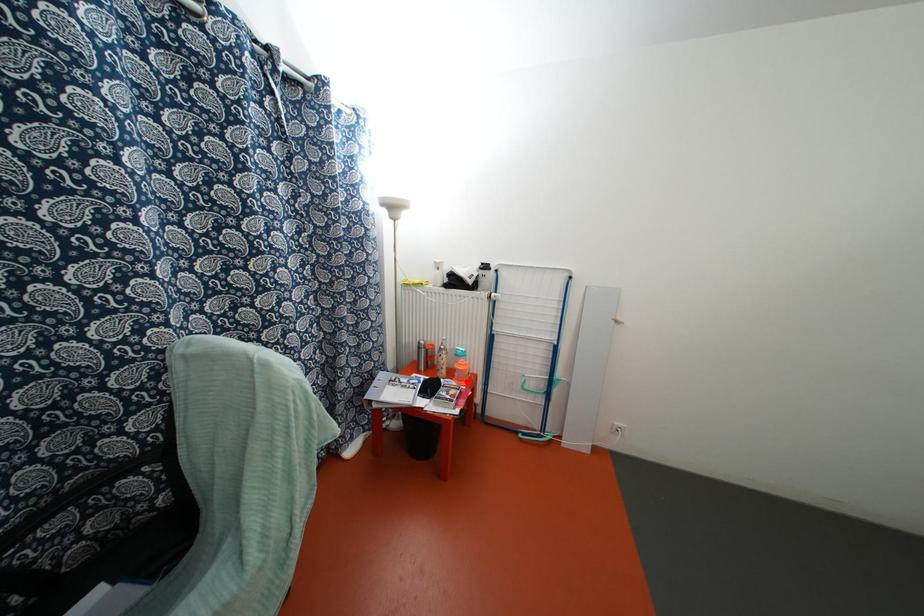
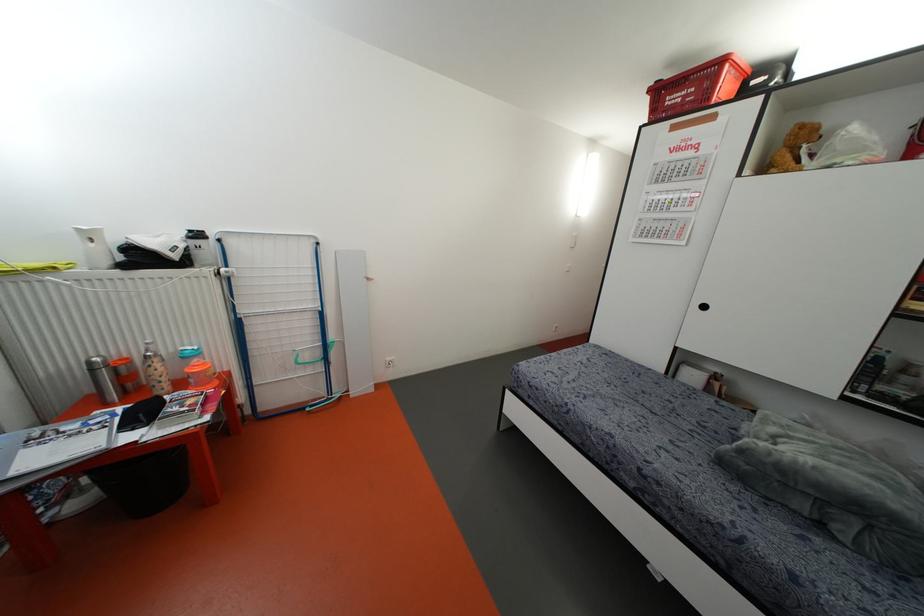
Question: A red point is marked in image1. In image2, is the corresponding 3D point closer to the camera or farther? Reply with the corresponding letter.

Choices:
 (A) The corresponding 3D point is closer.
 (B) The corresponding 3D point is farther.

Answer: (A)